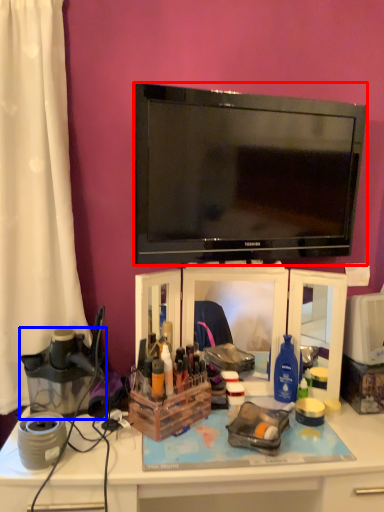
Question: Which object appears farthest to the camera in this image, television (highlighted by a red box) or appliance (highlighted by a blue box)?

Choices:
 (A) television
 (B) appliance

Answer: (B)